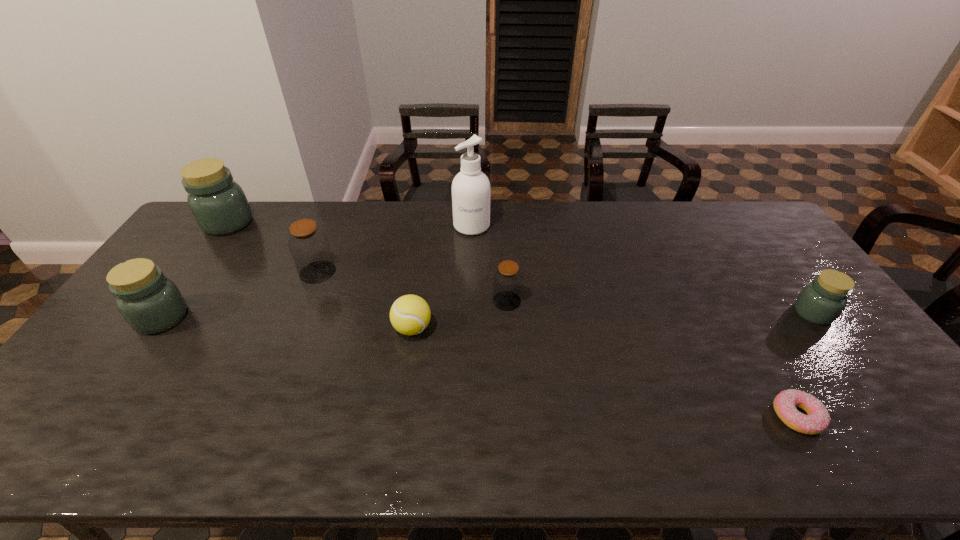
Where is `free space located on the front of the rightmost object`? The height and width of the screenshot is (540, 960). free space located on the front of the rightmost object is located at coordinates (877, 400).

The image size is (960, 540). What are the coordinates of `blank area located on the front of the yellow tennis ball` in the screenshot? It's located at (404, 385).

The image size is (960, 540). In order to click on vacant area situated 0.170m on the back of the doughnut in this screenshot , I will do `click(754, 341)`.

This screenshot has width=960, height=540. I want to click on cleansing agent located in the far edge section of the desktop, so click(x=471, y=189).

Find the location of a particular element. The image size is (960, 540). jar located at the far edge is located at coordinates (218, 204).

The width and height of the screenshot is (960, 540). Identify the location of object that is at the near edge. (817, 419).

Where is `object that is at the right edge`? object that is at the right edge is located at coordinates (821, 302).

Locate an element on the screen. object present at the far left corner is located at coordinates (218, 204).

The image size is (960, 540). In the image, there is a desktop. Find the location of `free region at the far edge`. free region at the far edge is located at coordinates (460, 233).

Identify the location of free spot at the near edge of the desktop. Image resolution: width=960 pixels, height=540 pixels. click(661, 448).